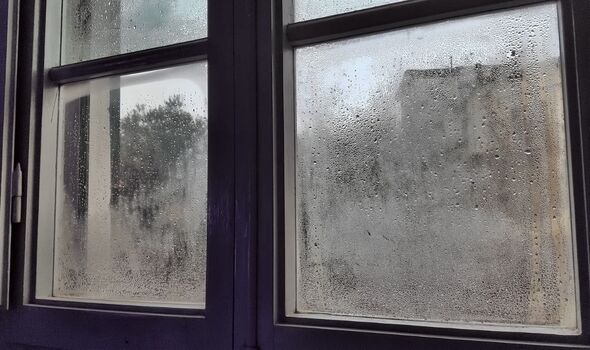
Image resolution: width=590 pixels, height=350 pixels. Identify the location of left windows. (101, 140), (119, 24).